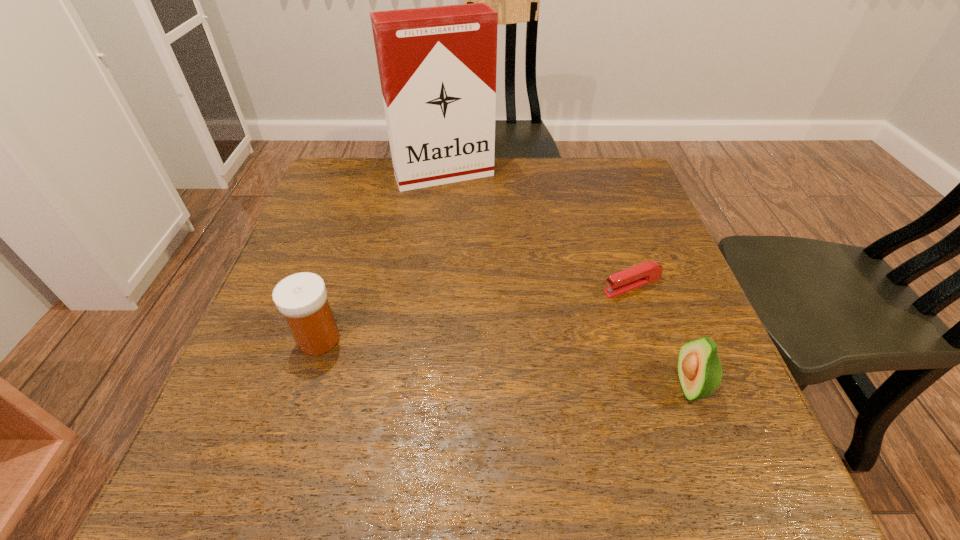
Where is `avocado present at the right edge`? Image resolution: width=960 pixels, height=540 pixels. avocado present at the right edge is located at coordinates (699, 368).

Identify the location of stapler at the right edge. (647, 272).

You are a GUI agent. You are given a task and a screenshot of the screen. Output one action in this format:
    pyautogui.click(x=<x>, y=<y>)
    Task: Click on the object situated at the near right corner
    Image resolution: width=960 pixels, height=540 pixels.
    Given the screenshot: What is the action you would take?
    pyautogui.click(x=699, y=368)

Where is `free space at the far edge of the desktop`? Image resolution: width=960 pixels, height=540 pixels. free space at the far edge of the desktop is located at coordinates (581, 204).

Locate an element on the screen. vacant space at the near edge of the desktop is located at coordinates (603, 396).

Find the location of `free location at the left edge of the desktop`. free location at the left edge of the desktop is located at coordinates (300, 237).

In the image, there is a desktop. Where is `blank space at the right edge`? This screenshot has height=540, width=960. blank space at the right edge is located at coordinates (632, 245).

Where is `free space at the far left corner of the desktop`? free space at the far left corner of the desktop is located at coordinates (348, 186).

In the image, there is a desktop. At what (x,y) coordinates should I click in order to perform the action: click on vacant space at the far right corner. Please return your answer as a coordinate pair (x, y). Looking at the image, I should click on (603, 174).

Identify the location of free space between the tallest object and the second farthest object. The image size is (960, 540). (538, 231).